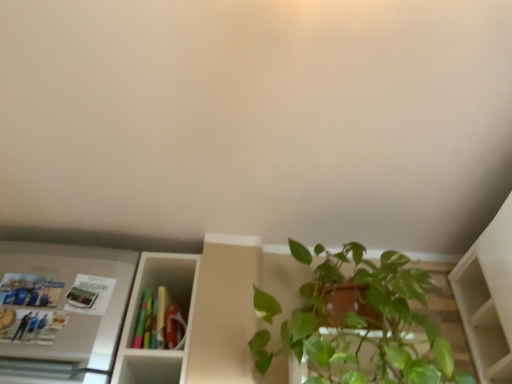
Question: Is metallic silver fridge at left positioned far away from green glossy plant at lower right?

Choices:
 (A) no
 (B) yes

Answer: (A)

Question: Can we say metallic silver fridge at left lies outside green glossy plant at lower right?

Choices:
 (A) yes
 (B) no

Answer: (A)

Question: Is metallic silver fridge at left at the left side of green glossy plant at lower right?

Choices:
 (A) yes
 (B) no

Answer: (A)

Question: Is the depth of metallic silver fridge at left less than that of green glossy plant at lower right?

Choices:
 (A) yes
 (B) no

Answer: (B)

Question: Considering the relative sizes of metallic silver fridge at left and green glossy plant at lower right in the image provided, is metallic silver fridge at left wider than green glossy plant at lower right?

Choices:
 (A) yes
 (B) no

Answer: (B)

Question: Is metallic silver fridge at left turned away from green glossy plant at lower right?

Choices:
 (A) yes
 (B) no

Answer: (B)

Question: Is metallic silver fridge at left positioned in front of matte plastic book at center?

Choices:
 (A) no
 (B) yes

Answer: (B)

Question: From the image's perspective, is metallic silver fridge at left over matte plastic book at center?

Choices:
 (A) no
 (B) yes

Answer: (B)

Question: Considering the relative sizes of metallic silver fridge at left and matte plastic book at center in the image provided, is metallic silver fridge at left taller than matte plastic book at center?

Choices:
 (A) no
 (B) yes

Answer: (B)

Question: From the image's perspective, is metallic silver fridge at left located beneath matte plastic book at center?

Choices:
 (A) no
 (B) yes

Answer: (A)

Question: Considering the relative sizes of metallic silver fridge at left and matte plastic book at center in the image provided, is metallic silver fridge at left smaller than matte plastic book at center?

Choices:
 (A) no
 (B) yes

Answer: (B)

Question: Does metallic silver fridge at left have a larger size compared to matte plastic book at center?

Choices:
 (A) no
 (B) yes

Answer: (A)

Question: Is green glossy plant at lower right oriented towards matte plastic book at center?

Choices:
 (A) yes
 (B) no

Answer: (B)